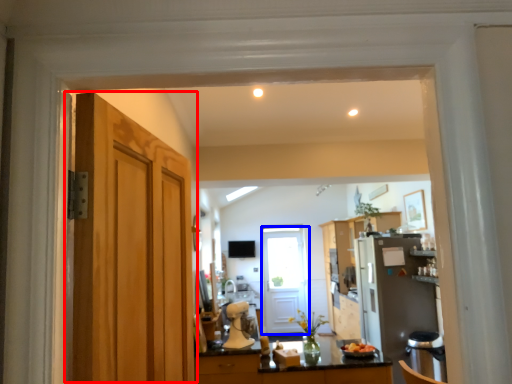
Question: Among these objects, which one is nearest to the camera, door (highlighted by a red box) or door (highlighted by a blue box)?

Choices:
 (A) door
 (B) door

Answer: (A)